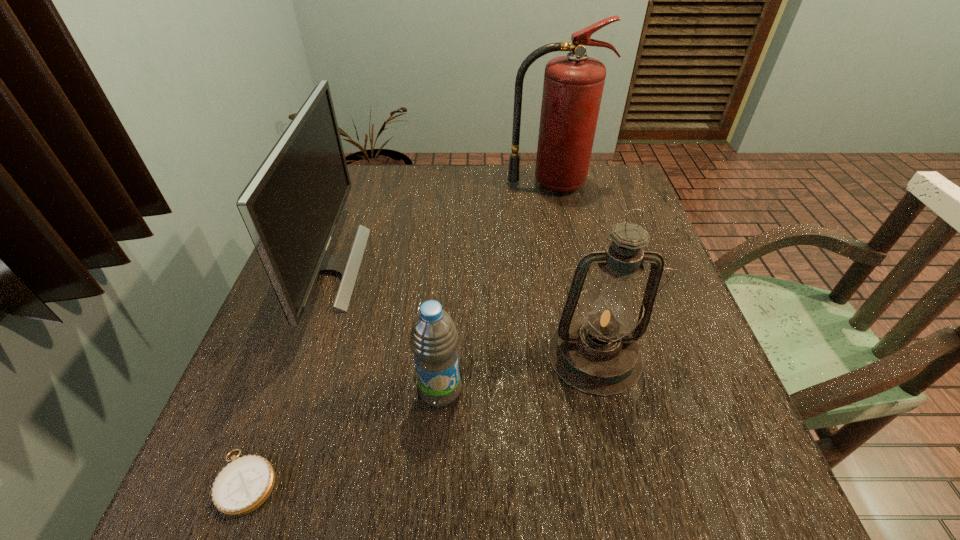
I want to click on vacant position in the image that satisfies the following two spatial constraints: 1. on the screen side of the monitor; 2. on the back side of the third object from left to right, so [x=282, y=390].

You are a GUI agent. You are given a task and a screenshot of the screen. Output one action in this format:
    pyautogui.click(x=<x>, y=<y>)
    Task: Click on the vacant position in the image that satisfies the following two spatial constraints: 1. at the front of the tallest object where the nozzle is aimed; 2. on the left side of the oil lamp
    
    Given the screenshot: What is the action you would take?
    pyautogui.click(x=587, y=355)

Find the location of a particular element. free space in the image that satisfies the following two spatial constraints: 1. on the screen side of the monitor; 2. on the back side of the oil lamp is located at coordinates (296, 355).

The width and height of the screenshot is (960, 540). I want to click on vacant point that satisfies the following two spatial constraints: 1. at the front of the farthest object where the nozzle is aimed; 2. on the screen side of the monitor, so click(x=568, y=267).

Find the location of a particular element. The image size is (960, 540). vacant area that satisfies the following two spatial constraints: 1. on the screen side of the monitor; 2. on the left side of the water bottle is located at coordinates (282, 390).

This screenshot has height=540, width=960. What are the coordinates of `free space that satisfies the following two spatial constraints: 1. on the screen side of the water bottle; 2. on the right side of the monitor` in the screenshot? It's located at (282, 390).